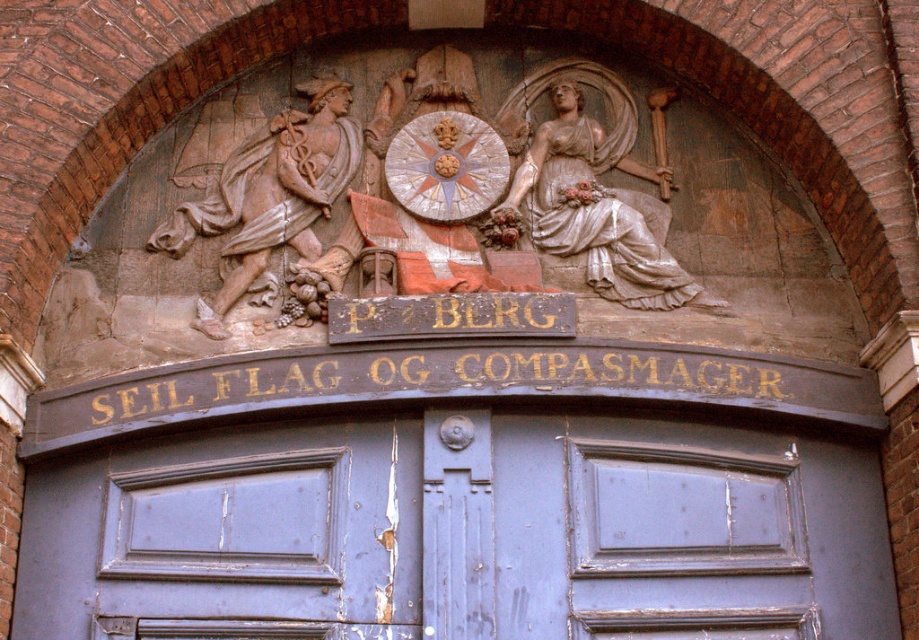
You are an architect assessing the symmetry of the building entrance. The blue painted wood door at center and the white marble statue at upper right are key elements. Which element has a greater width?

The blue painted wood door at center has a greater width than the white marble statue at upper right according to the description.

You are an architect inspecting the building facade. You need to install a new security camera. The camera must be placed above the blue painted wood door at center but cannot be mounted on the white marble statue at upper right. Where should you position the camera?

The blue painted wood door at center is below the white marble statue at upper right, so the camera can be mounted on the area between them or on the archway above the door but below the statue.